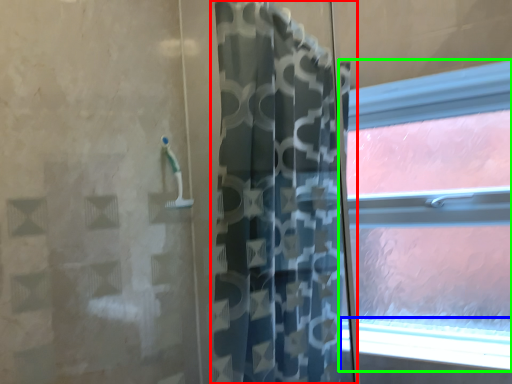
Question: Estimate the real-world distances between objects in this image. Which object is closer to curtain (highlighted by a red box), window sill (highlighted by a blue box) or window (highlighted by a green box)?

Choices:
 (A) window sill
 (B) window

Answer: (A)